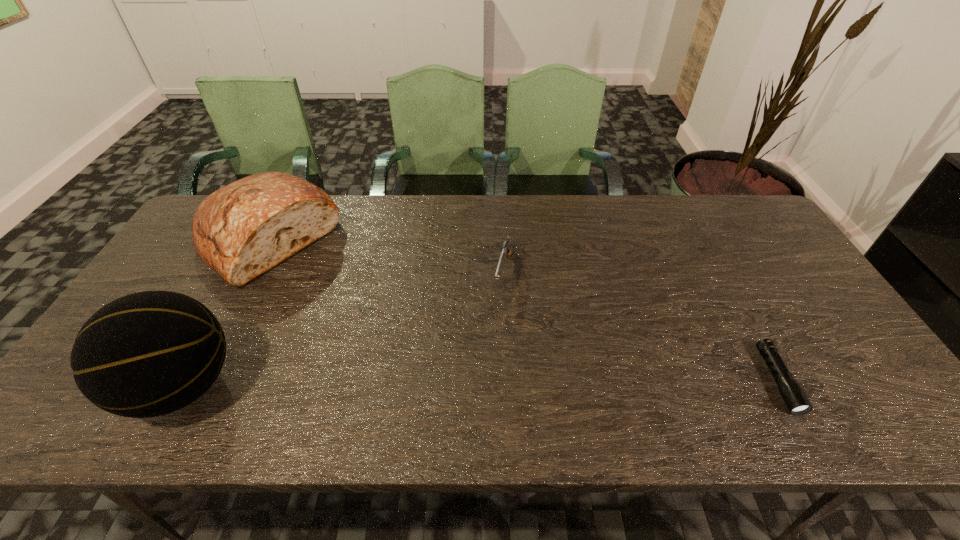
Locate an element on the screen. The image size is (960, 540). free space at the far edge of the desktop is located at coordinates (417, 203).

This screenshot has height=540, width=960. I want to click on free spot at the near edge of the desktop, so click(x=804, y=375).

Locate an element on the screen. Image resolution: width=960 pixels, height=540 pixels. vacant space at the left edge of the desktop is located at coordinates (170, 279).

This screenshot has height=540, width=960. In order to click on free location at the far right corner of the desktop in this screenshot , I will do `click(733, 221)`.

The height and width of the screenshot is (540, 960). I want to click on vacant space that's between the bread and the rightmost object, so click(523, 310).

The image size is (960, 540). Find the location of `vacant area between the bread and the basketball`. vacant area between the bread and the basketball is located at coordinates (226, 313).

Locate an element on the screen. The width and height of the screenshot is (960, 540). blank region between the bread and the third tallest object is located at coordinates (386, 256).

Where is `free space between the basketball and the gun`? The image size is (960, 540). free space between the basketball and the gun is located at coordinates (344, 329).

You are a GUI agent. You are given a task and a screenshot of the screen. Output one action in this format:
    pyautogui.click(x=<x>, y=<y>)
    Task: Click on the vacant space that is in between the third object from left to right and the bread
    The height and width of the screenshot is (540, 960).
    Given the screenshot: What is the action you would take?
    point(386,256)

Where is `empty space between the gun and the shortest object`? empty space between the gun and the shortest object is located at coordinates (640, 326).